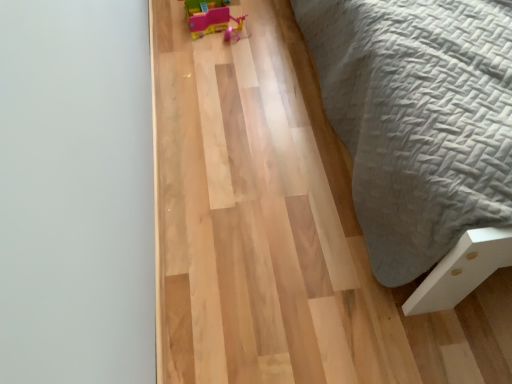
Identify the location of natural wood floor at center. (422, 133).

What do you see at coordinates (422, 133) in the screenshot? The height and width of the screenshot is (384, 512). I see `natural wood floor at center` at bounding box center [422, 133].

Identify the location of pink plastic toy at upper center. (212, 19).

What do you see at coordinates (212, 19) in the screenshot?
I see `pink plastic toy at upper center` at bounding box center [212, 19].

Identify the location of natural wood floor at center. (422, 133).

Considering the relative positions of pink plastic toy at upper center and natural wood floor at center in the image provided, is pink plastic toy at upper center to the right of natural wood floor at center from the viewer's perspective?

No, pink plastic toy at upper center is not to the right of natural wood floor at center.

Is pink plastic toy at upper center in front of or behind natural wood floor at center in the image?

In the image, pink plastic toy at upper center appears behind natural wood floor at center.

Which point is more forward, (198, 31) or (402, 63)?

The point (402, 63) is closer.

From the image's perspective, is pink plastic toy at upper center above or below natural wood floor at center?

From the image's perspective, pink plastic toy at upper center appears above natural wood floor at center.

From a real-world perspective, between pink plastic toy at upper center and natural wood floor at center, who is vertically higher?

From a 3D spatial view, pink plastic toy at upper center is above.

Considering the relative sizes of pink plastic toy at upper center and natural wood floor at center in the image provided, is pink plastic toy at upper center wider than natural wood floor at center?

In fact, pink plastic toy at upper center might be narrower than natural wood floor at center.

Does pink plastic toy at upper center have a greater height compared to natural wood floor at center?

Yes, pink plastic toy at upper center is taller than natural wood floor at center.

Considering the sizes of objects pink plastic toy at upper center and natural wood floor at center in the image provided, who is bigger, pink plastic toy at upper center or natural wood floor at center?

natural wood floor at center.

Could natural wood floor at center be considered to be inside pink plastic toy at upper center?

No, natural wood floor at center is located outside of pink plastic toy at upper center.

Can you see pink plastic toy at upper center touching natural wood floor at center?

pink plastic toy at upper center is not next to natural wood floor at center, and they're not touching.

Does pink plastic toy at upper center turn towards natural wood floor at center?

No, pink plastic toy at upper center is not aimed at natural wood floor at center.

Measure the distance from pink plastic toy at upper center to natural wood floor at center.

They are 81.01 centimeters apart.

At what (x,y) coordinates should I click in order to perform the action: click on furniture in front of the pink plastic toy at upper center. Please return your answer as a coordinate pair (x, y). This screenshot has width=512, height=384. Looking at the image, I should click on (422, 133).

Between natural wood floor at center and pink plastic toy at upper center, which one appears on the right side from the viewer's perspective?

Positioned to the right is natural wood floor at center.

Is natural wood floor at center in front of or behind pink plastic toy at upper center in the image?

natural wood floor at center is in front of pink plastic toy at upper center.

Is point (489, 112) positioned in front of point (192, 15)?

Yes, it is in front of point (192, 15).

From the image's perspective, does natural wood floor at center appear lower than pink plastic toy at upper center?

Correct, natural wood floor at center appears lower than pink plastic toy at upper center in the image.

From a real-world perspective, which object rests below the other?

From a 3D spatial view, natural wood floor at center is below.

In terms of width, does natural wood floor at center look wider or thinner when compared to pink plastic toy at upper center?

natural wood floor at center is wider than pink plastic toy at upper center.

Which of these two, natural wood floor at center or pink plastic toy at upper center, stands taller?

pink plastic toy at upper center.

Looking at this image, does natural wood floor at center have a smaller size compared to pink plastic toy at upper center?

No.

Is natural wood floor at center inside the boundaries of pink plastic toy at upper center, or outside?

natural wood floor at center cannot be found inside pink plastic toy at upper center.

Would you say natural wood floor at center is a long distance from pink plastic toy at upper center?

No, natural wood floor at center is not far away from pink plastic toy at upper center.

Is natural wood floor at center oriented towards pink plastic toy at upper center?

No, natural wood floor at center does not turn towards pink plastic toy at upper center.

How far apart are natural wood floor at center and pink plastic toy at upper center?

The distance of natural wood floor at center from pink plastic toy at upper center is 81.01 centimeters.

At what (x,y) coordinates should I click in order to perform the action: click on toy above the natural wood floor at center (from the image's perspective). Please return your answer as a coordinate pair (x, y). Image resolution: width=512 pixels, height=384 pixels. Looking at the image, I should click on tap(212, 19).

The width and height of the screenshot is (512, 384). Identify the location of toy above the natural wood floor at center (from the image's perspective). (212, 19).

Identify the location of toy located above the natural wood floor at center (from a real-world perspective). The image size is (512, 384). (212, 19).